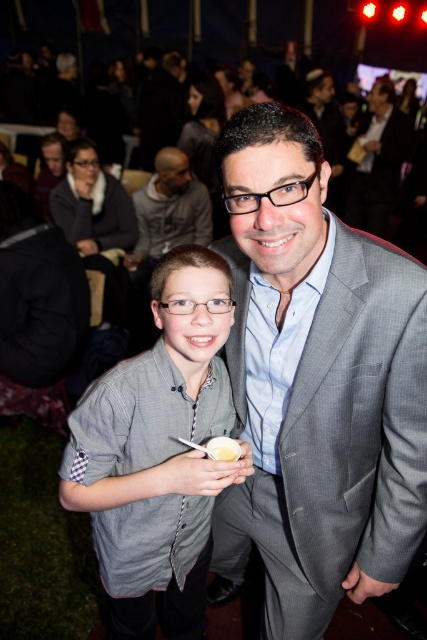
Question: Which point is closer to the camera?

Choices:
 (A) (230, 262)
 (B) (142, 209)
 (C) (391, 120)

Answer: (A)

Question: Estimate the real-world distances between objects in this image. Which object is closer to the gray striped shirt at center?

Choices:
 (A) dark gray suit at upper center
 (B) gray suit at center

Answer: (B)

Question: Can you confirm if gray striped shirt at center is positioned above white creamy food at center?

Choices:
 (A) yes
 (B) no

Answer: (B)

Question: Can you confirm if gray striped shirt at center is bigger than gray hoodie at upper center?

Choices:
 (A) yes
 (B) no

Answer: (A)

Question: Does gray suit at center appear under gray hoodie at upper center?

Choices:
 (A) yes
 (B) no

Answer: (A)

Question: Which of these objects is positioned closest to the dark gray suit at upper center?

Choices:
 (A) white creamy food at center
 (B) gray hoodie at upper center
 (C) gray suit at center
 (D) gray striped shirt at center

Answer: (B)